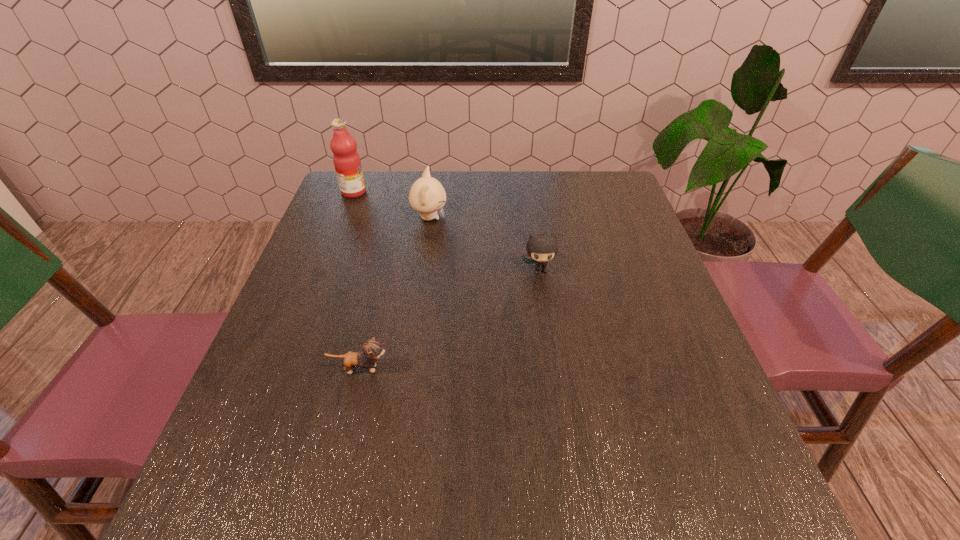
Identify the location of free location located on the front-facing side of the third farthest object. (554, 370).

Find the location of a particular element. This screenshot has width=960, height=540. vacant space located on the front-facing side of the shortest object is located at coordinates (570, 369).

Identify the location of fruit juice located in the far edge section of the desktop. The image size is (960, 540). (346, 159).

This screenshot has height=540, width=960. I want to click on kitten that is at the far edge, so click(x=427, y=195).

The width and height of the screenshot is (960, 540). What are the coordinates of `fruit juice at the left edge` in the screenshot? It's located at (346, 159).

This screenshot has width=960, height=540. I want to click on kitten situated at the left edge, so click(372, 349).

This screenshot has width=960, height=540. Identify the location of object at the far left corner. (346, 159).

This screenshot has width=960, height=540. Find the location of `vacant space at the far edge of the desktop`. vacant space at the far edge of the desktop is located at coordinates (531, 199).

This screenshot has height=540, width=960. Identify the location of blank space at the near edge. (369, 521).

Find the location of a particular element. This screenshot has width=960, height=540. vacant region at the left edge is located at coordinates (309, 259).